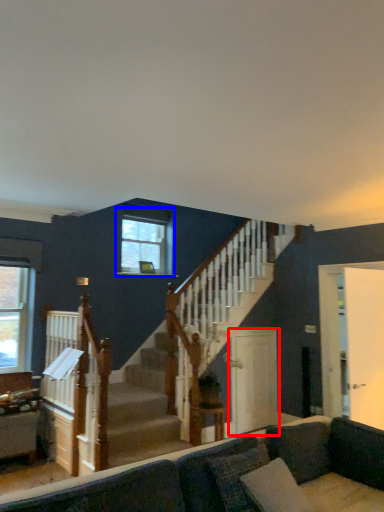
Question: Among these objects, which one is farthest to the camera, screen door (highlighted by a red box) or window (highlighted by a blue box)?

Choices:
 (A) screen door
 (B) window

Answer: (B)